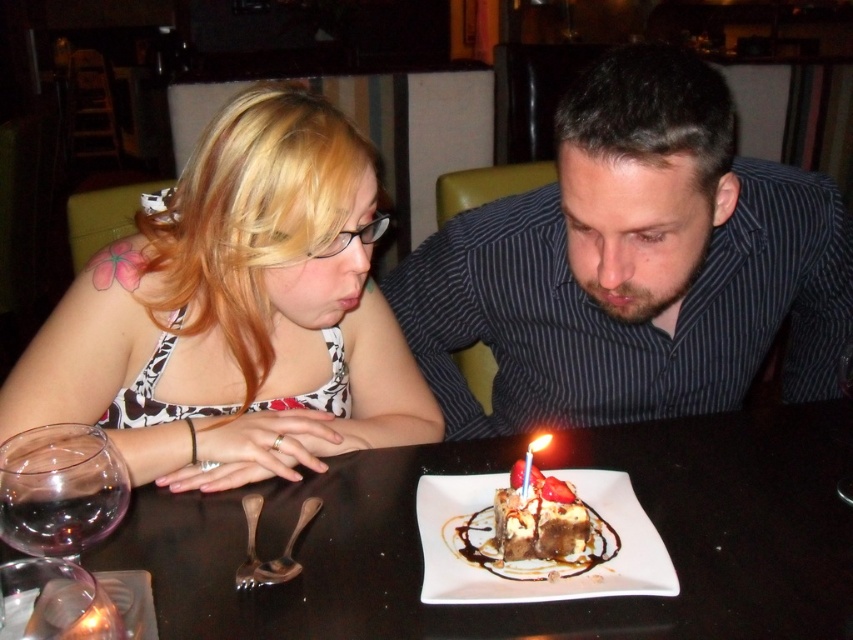
Who is shorter, striped shirt at center or red wax candle at center?

Standing shorter between the two is red wax candle at center.

Consider the image. Who is higher up, striped shirt at center or red wax candle at center?

Positioned higher is striped shirt at center.

Locate an element on the screen. striped shirt at center is located at coordinates (633, 266).

What do you see at coordinates (633, 266) in the screenshot? This screenshot has height=640, width=853. I see `striped shirt at center` at bounding box center [633, 266].

Is point (518, 273) farther from viewer compared to point (485, 605)?

Yes.

Identify the location of striped shirt at center. The image size is (853, 640). (633, 266).

Locate an element on the screen. This screenshot has width=853, height=640. matte black tank top at left is located at coordinates (236, 314).

The height and width of the screenshot is (640, 853). Describe the element at coordinates (236, 314) in the screenshot. I see `matte black tank top at left` at that location.

This screenshot has width=853, height=640. In order to click on matte black tank top at left in this screenshot , I will do `click(236, 314)`.